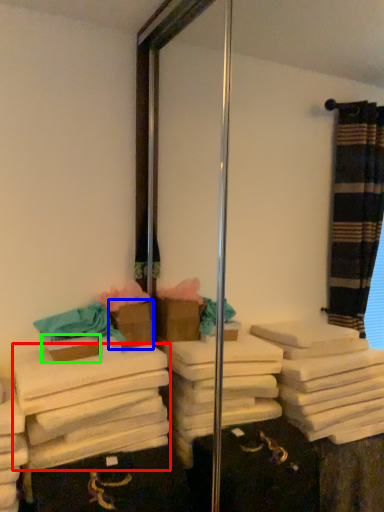
Question: Based on their relative distances, which object is farther from bath towel (highlighted by a red box)? Choose from box (highlighted by a blue box) and box (highlighted by a green box).

Choices:
 (A) box
 (B) box

Answer: (A)